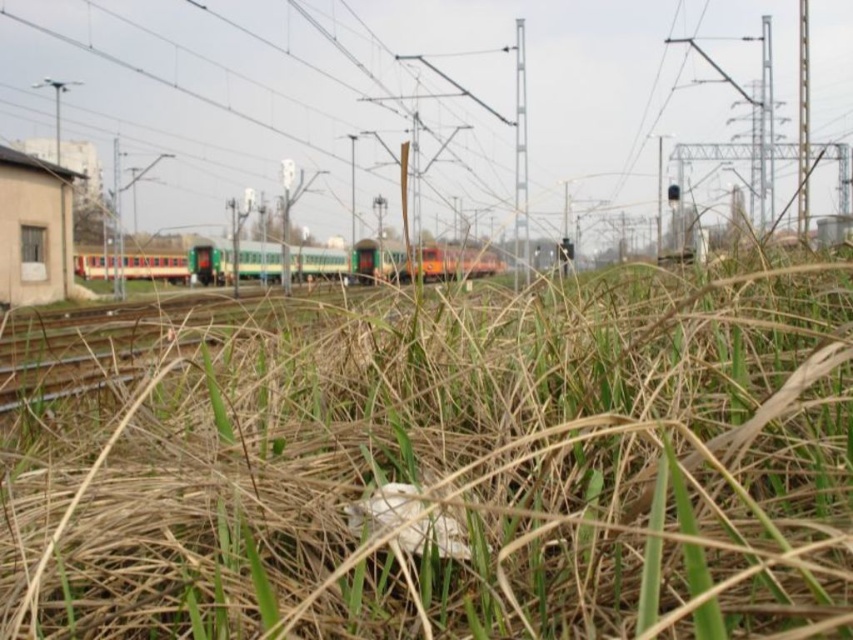
Question: Is dry grass at center smaller than green matte train at center?

Choices:
 (A) no
 (B) yes

Answer: (B)

Question: Considering the relative positions of dry grass at center and green matte train at center in the image provided, where is dry grass at center located with respect to green matte train at center?

Choices:
 (A) right
 (B) left

Answer: (A)

Question: Which point is farther to the camera?

Choices:
 (A) dry grass at center
 (B) green matte train at center

Answer: (B)

Question: Can you confirm if dry grass at center is positioned above green matte train at center?

Choices:
 (A) yes
 (B) no

Answer: (B)

Question: Which point is farther to the camera?

Choices:
 (A) tap(242, 320)
 (B) tap(146, 269)

Answer: (B)